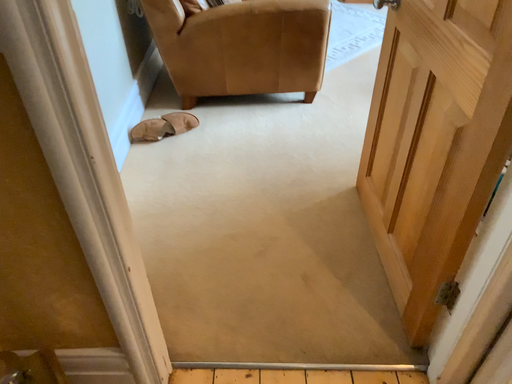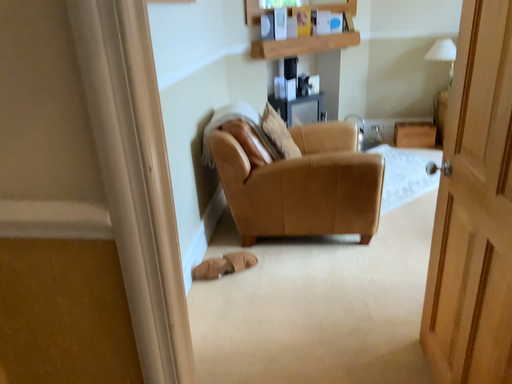
Question: Which way did the camera rotate in the video?

Choices:
 (A) rotated left
 (B) rotated right

Answer: (A)